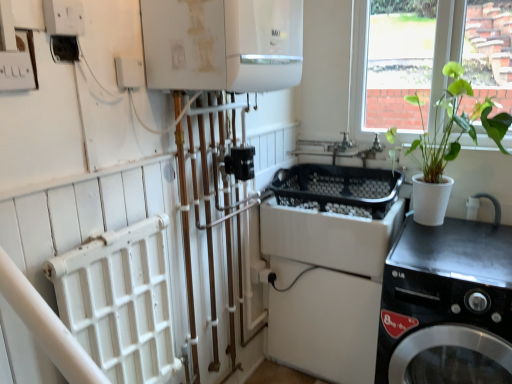
Question: Considering the relative sizes of green leafy plant in white pot at right and white plastic electric outlet at upper left in the image provided, is green leafy plant in white pot at right smaller than white plastic electric outlet at upper left?

Choices:
 (A) yes
 (B) no

Answer: (B)

Question: Is green leafy plant in white pot at right oriented towards white plastic electric outlet at upper left?

Choices:
 (A) no
 (B) yes

Answer: (A)

Question: Is green leafy plant in white pot at right bigger than white plastic electric outlet at upper left?

Choices:
 (A) yes
 (B) no

Answer: (A)

Question: Is green leafy plant in white pot at right surrounding white plastic electric outlet at upper left?

Choices:
 (A) no
 (B) yes

Answer: (A)

Question: Does green leafy plant in white pot at right appear on the right side of white plastic electric outlet at upper left?

Choices:
 (A) no
 (B) yes

Answer: (B)

Question: From the image's perspective, is green leafy plant in white pot at right located above white plastic electric outlet at upper left?

Choices:
 (A) yes
 (B) no

Answer: (B)

Question: Is transparent glass window at upper right outside of green leafy plant in white pot at right?

Choices:
 (A) yes
 (B) no

Answer: (A)

Question: Is transparent glass window at upper right to the left of green leafy plant in white pot at right from the viewer's perspective?

Choices:
 (A) yes
 (B) no

Answer: (B)

Question: Is transparent glass window at upper right taller than green leafy plant in white pot at right?

Choices:
 (A) no
 (B) yes

Answer: (B)

Question: From a real-world perspective, is transparent glass window at upper right beneath green leafy plant in white pot at right?

Choices:
 (A) yes
 (B) no

Answer: (B)

Question: Is transparent glass window at upper right oriented towards green leafy plant in white pot at right?

Choices:
 (A) yes
 (B) no

Answer: (A)

Question: Is transparent glass window at upper right further to the viewer compared to green leafy plant in white pot at right?

Choices:
 (A) yes
 (B) no

Answer: (A)

Question: Is white glossy boiler at upper center next to transparent glass window at upper right and touching it?

Choices:
 (A) no
 (B) yes

Answer: (A)